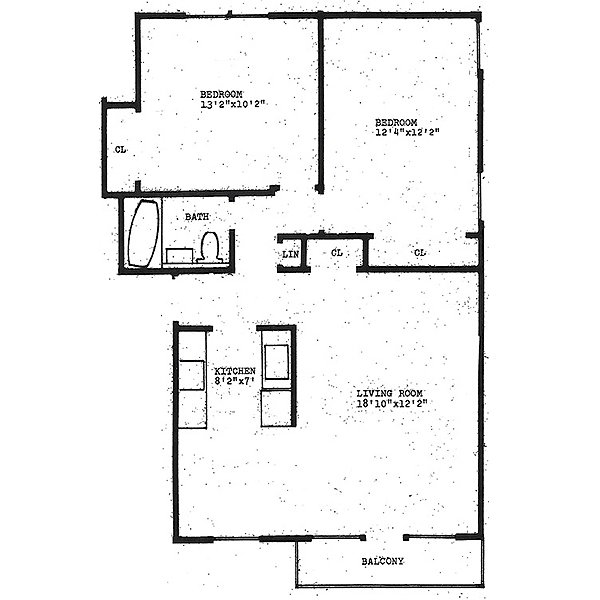
Identify the location of linen closet. This screenshot has height=600, width=600. (293, 247).